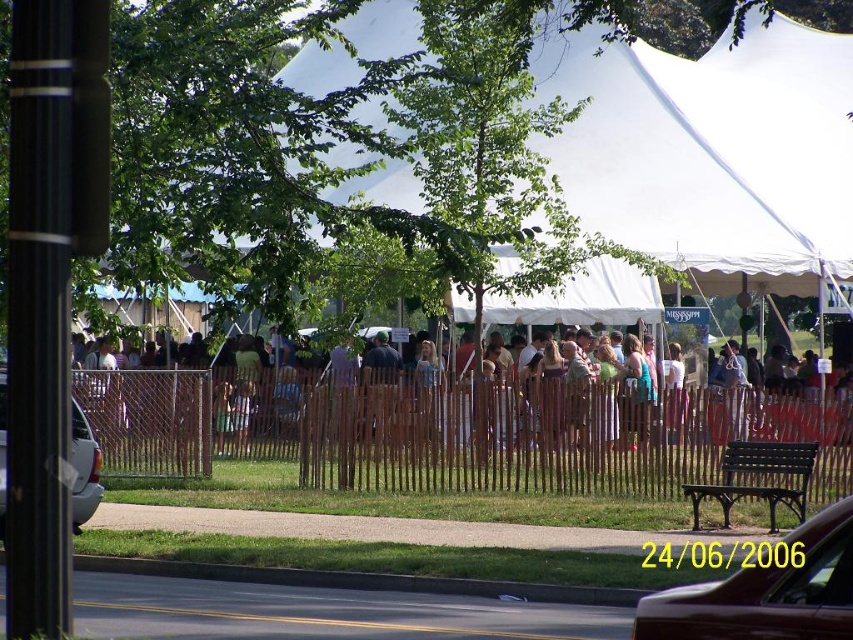
Can you confirm if shiny brown car at lower right is positioned to the right of green wooden bench at lower right?

No, shiny brown car at lower right is not to the right of green wooden bench at lower right.

Which of these two, shiny brown car at lower right or green wooden bench at lower right, stands taller?

Standing taller between the two is green wooden bench at lower right.

Which is in front, point (813, 564) or point (712, 492)?

Point (813, 564)

Where is `shiny brown car at lower right`? shiny brown car at lower right is located at coordinates (767, 592).

The image size is (853, 640). Identify the location of light brown wooden fence at center. (440, 412).

At what (x,y) coordinates should I click in order to perform the action: click on light brown wooden fence at center. Please return your answer as a coordinate pair (x, y). The image size is (853, 640). Looking at the image, I should click on (x=440, y=412).

Who is shorter, brown wooden fence at center or green wooden bench at lower right?

With less height is green wooden bench at lower right.

Is brown wooden fence at center to the left of green wooden bench at lower right from the viewer's perspective?

Correct, you'll find brown wooden fence at center to the left of green wooden bench at lower right.

The image size is (853, 640). In order to click on brown wooden fence at center in this screenshot , I will do `click(457, 433)`.